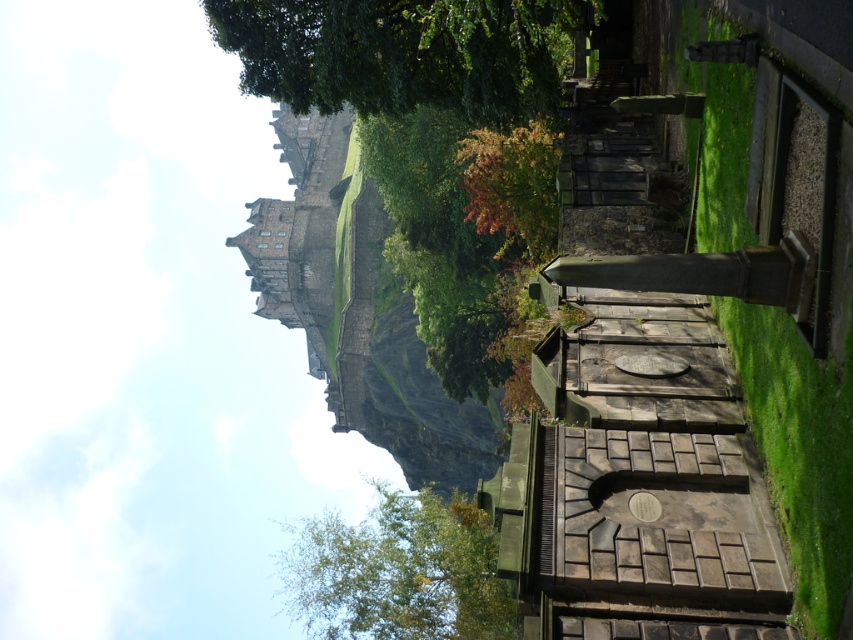
Question: Based on their relative distances, which object is nearer to the orange leafy tree at center?

Choices:
 (A) green leafy tree at center
 (B) green leafy tree at upper center

Answer: (B)

Question: Which object is closer to the camera taking this photo?

Choices:
 (A) orange leafy tree at center
 (B) green leafy tree at upper center
 (C) green leafy tree at center

Answer: (B)

Question: Can you confirm if green leafy tree at center is positioned to the right of orange leafy tree at center?

Choices:
 (A) yes
 (B) no

Answer: (B)

Question: Is green leafy tree at upper center thinner than green leafy tree at center?

Choices:
 (A) no
 (B) yes

Answer: (B)

Question: Can you confirm if green leafy tree at upper center is thinner than orange leafy tree at center?

Choices:
 (A) no
 (B) yes

Answer: (A)

Question: Which point appears closest to the camera in this image?

Choices:
 (A) (247, 67)
 (B) (474, 561)

Answer: (A)